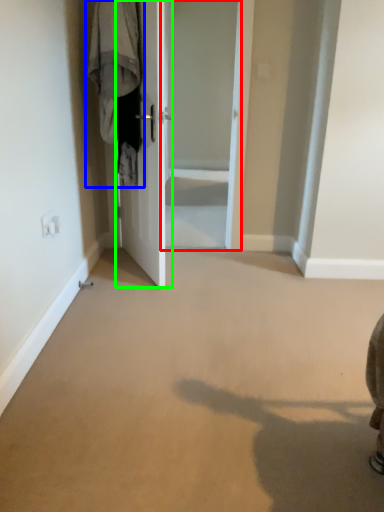
Question: Which object is the closest to the screen door (highlighted by a red box)? Choose among these: laundry (highlighted by a blue box) or door (highlighted by a green box).

Choices:
 (A) laundry
 (B) door

Answer: (B)